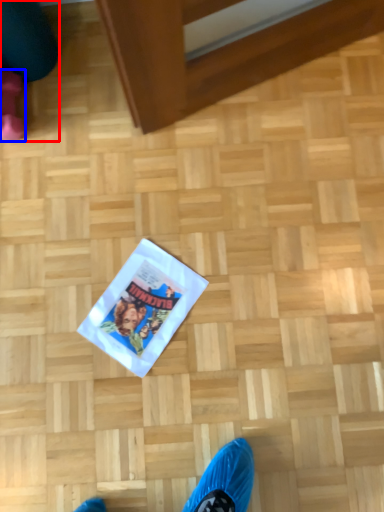
Question: Which of the following is the closest to the observer, leg (highlighted by a red box) or footwear (highlighted by a blue box)?

Choices:
 (A) leg
 (B) footwear

Answer: (A)